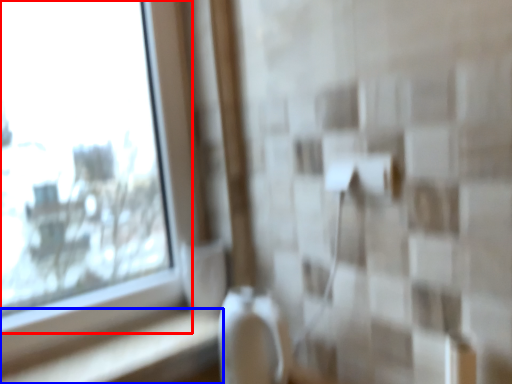
Question: Which point is further to the camera, window (highlighted by a red box) or ledge (highlighted by a blue box)?

Choices:
 (A) window
 (B) ledge

Answer: (B)